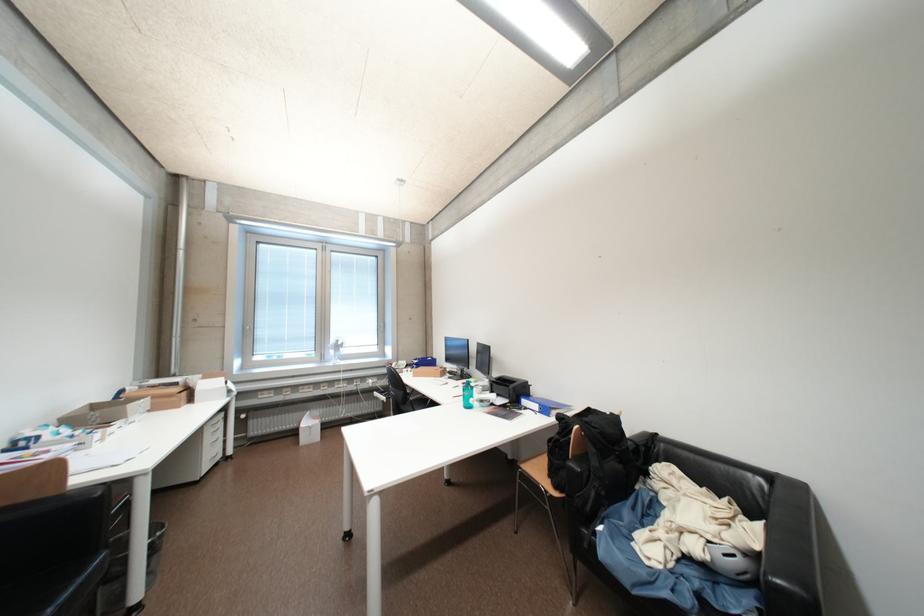
This screenshot has height=616, width=924. I want to click on sofa armrest, so click(x=602, y=477).